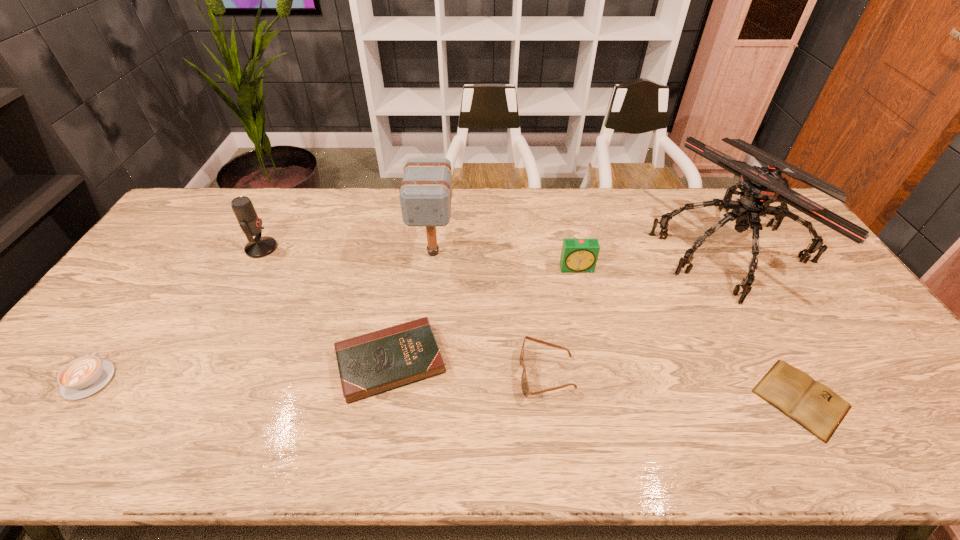
In the image, there is a desktop. Identify the location of free space at the left edge. (128, 339).

The image size is (960, 540). Find the location of `vacant point at the right edge`. vacant point at the right edge is located at coordinates tap(838, 347).

In the image, there is a desktop. Identify the location of vacant region at the far left corner. (211, 225).

What are the coordinates of `unoccupied area between the third tallest object and the alarm clock` in the screenshot? It's located at 420,258.

Image resolution: width=960 pixels, height=540 pixels. I want to click on empty space between the book and the second object from left to right, so click(x=531, y=323).

The width and height of the screenshot is (960, 540). I want to click on free space between the alarm clock and the cappuccino, so click(x=333, y=324).

Find the location of a particular element. vacant space in between the Bible and the fifth shortest object is located at coordinates (484, 315).

Find the location of a particular element. free area in between the fourth tallest object and the mallet is located at coordinates (505, 260).

The width and height of the screenshot is (960, 540). I want to click on free space between the book and the Bible, so click(595, 380).

Identify the location of vacant space that's between the drone and the shortest object. (765, 323).